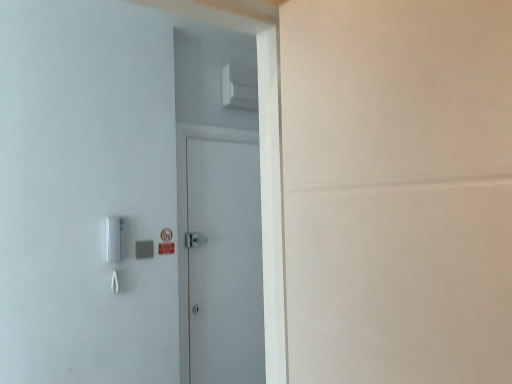
Question: Should I look upward or downward to see gray matte/light switch at left?

Choices:
 (A) down
 (B) up

Answer: (A)

Question: From the image's perspective, is white matte door at center located beneath gray matte/light switch at left?

Choices:
 (A) yes
 (B) no

Answer: (A)

Question: Can you confirm if white matte door at center is thinner than gray matte/light switch at left?

Choices:
 (A) no
 (B) yes

Answer: (A)

Question: Is white matte door at center wider than gray matte/light switch at left?

Choices:
 (A) no
 (B) yes

Answer: (B)

Question: Does white matte door at center have a lesser height compared to gray matte/light switch at left?

Choices:
 (A) no
 (B) yes

Answer: (A)

Question: From a real-world perspective, is white matte door at center over gray matte/light switch at left?

Choices:
 (A) no
 (B) yes

Answer: (A)

Question: Considering the relative sizes of white matte door at center and gray matte/light switch at left in the image provided, is white matte door at center taller than gray matte/light switch at left?

Choices:
 (A) no
 (B) yes

Answer: (B)

Question: Is the position of gray matte/light switch at left more distant than that of white matte door at center?

Choices:
 (A) no
 (B) yes

Answer: (A)

Question: Is gray matte/light switch at left in contact with white matte door at center?

Choices:
 (A) yes
 (B) no

Answer: (B)

Question: Does gray matte/light switch at left have a lesser height compared to white matte door at center?

Choices:
 (A) no
 (B) yes

Answer: (B)

Question: From a real-world perspective, is gray matte/light switch at left located beneath white matte door at center?

Choices:
 (A) yes
 (B) no

Answer: (B)

Question: From the image's perspective, does gray matte/light switch at left appear lower than white matte door at center?

Choices:
 (A) yes
 (B) no

Answer: (B)

Question: Is gray matte/light switch at left turned away from white matte door at center?

Choices:
 (A) no
 (B) yes

Answer: (A)

Question: Considering the positions of gray matte/light switch at left and white matte door at center in the image, is gray matte/light switch at left bigger or smaller than white matte door at center?

Choices:
 (A) small
 (B) big

Answer: (A)